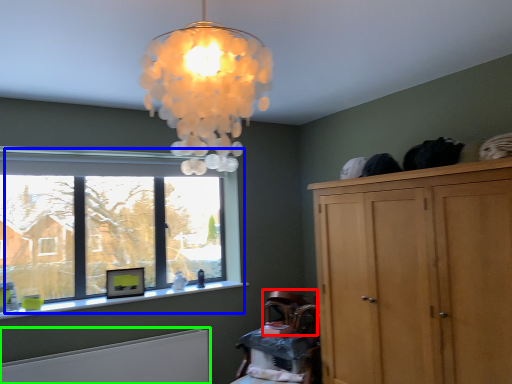
Question: Based on their relative distances, which object is nearer to armchair (highlighted by a red box)? Choose from window (highlighted by a blue box) and radiator (highlighted by a green box).

Choices:
 (A) window
 (B) radiator

Answer: (B)